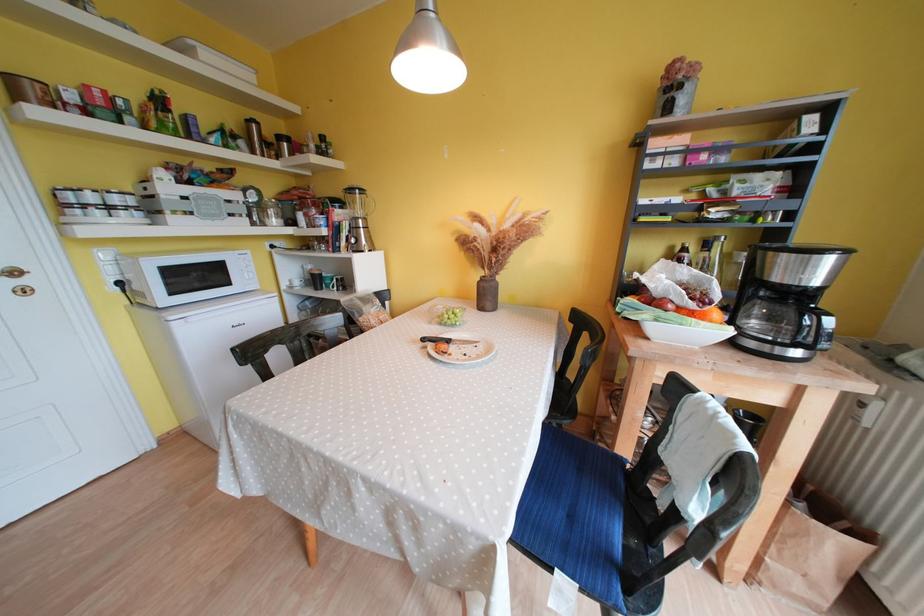
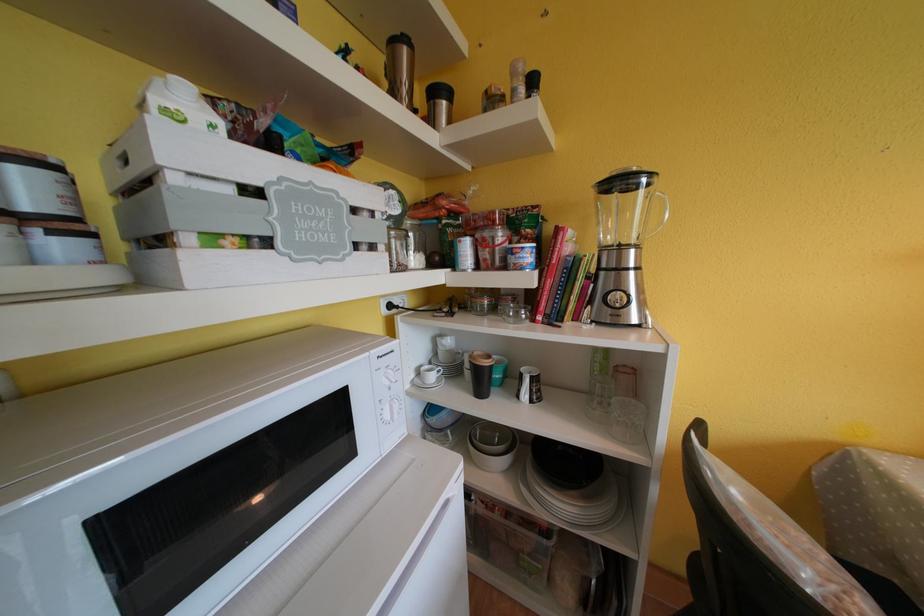
The point at (286,140) is marked in the first image. Where is the corresponding point in the second image?

(440, 95)